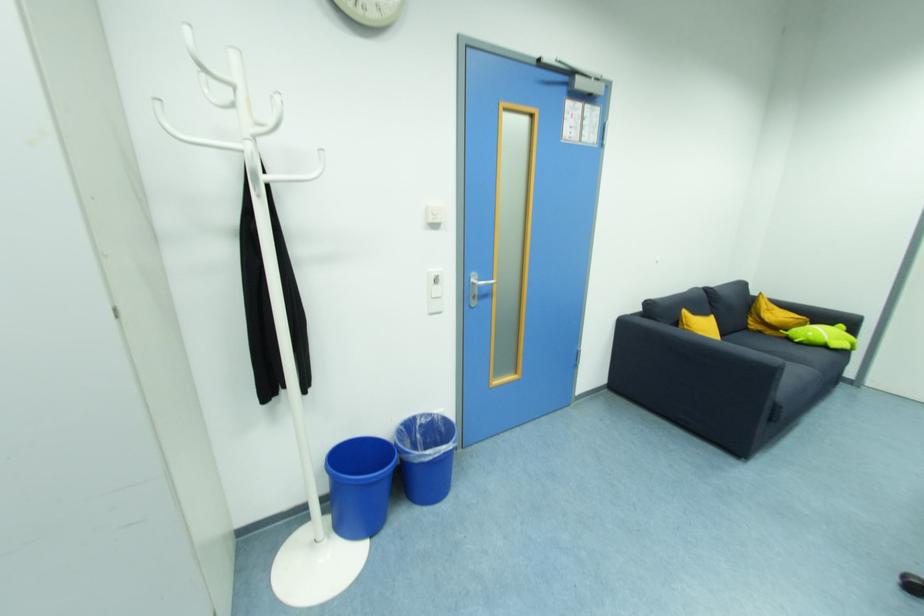
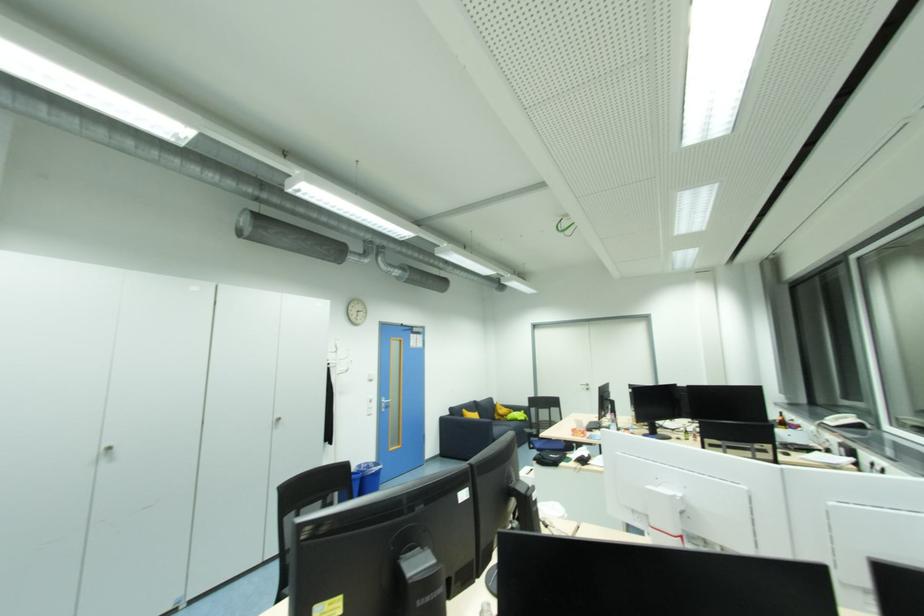
Locate, in the second image, the point that corresponds to point 476,282 in the first image.

(386, 402)